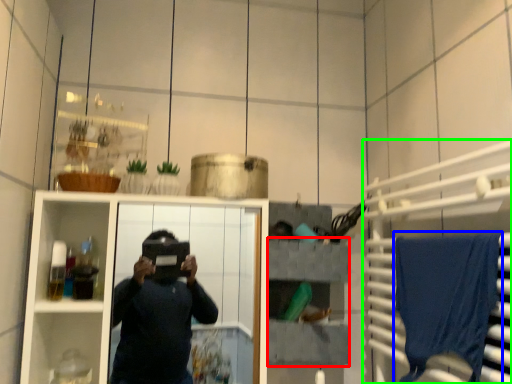
Question: Which object is the closest to the shelf (highlighted by a red box)? Choose among these: bath towel (highlighted by a blue box) or cabinet (highlighted by a green box).

Choices:
 (A) bath towel
 (B) cabinet

Answer: (B)